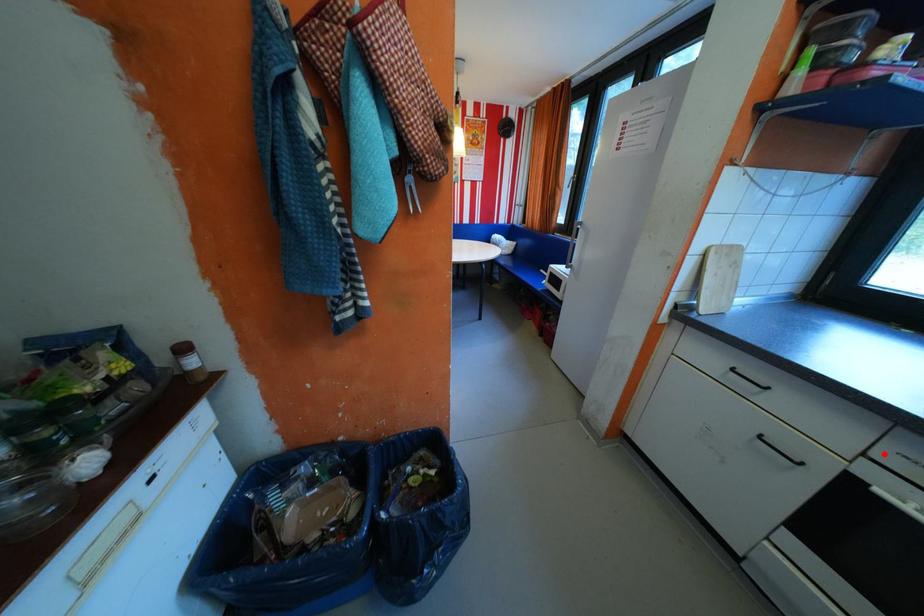
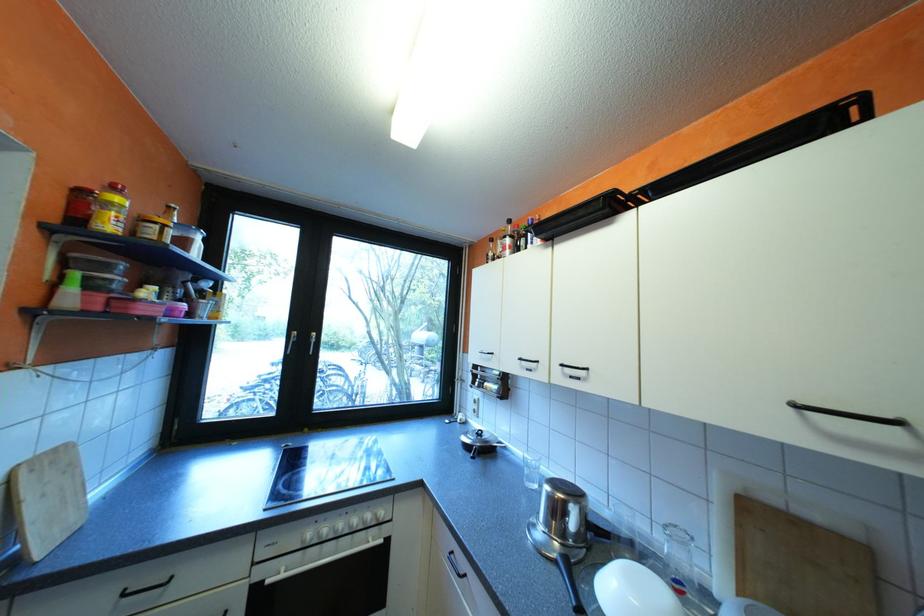
Find the pixel in the second image that matches the highlighted location in the first image.

(268, 559)